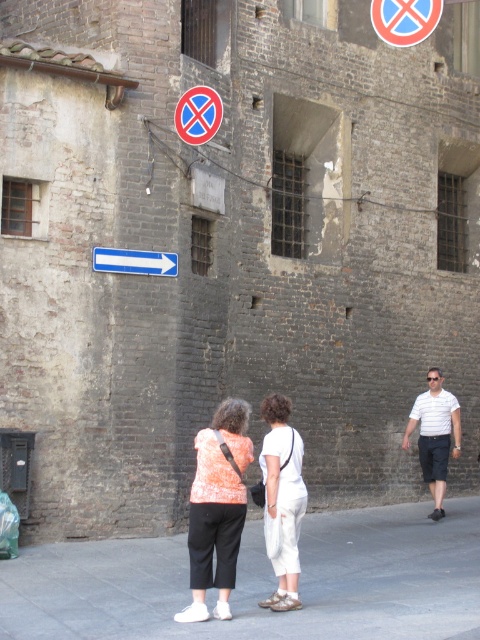
Is orange printed blouse at center thinner than white cotton shirt at right?

Indeed, orange printed blouse at center has a lesser width compared to white cotton shirt at right.

Is orange printed blouse at center closer to the viewer compared to white cotton shirt at right?

Yes, it is.

Which is behind, point (231, 529) or point (447, 451)?

The point (447, 451) is behind.

Find the location of a particular element. This screenshot has width=480, height=640. orange printed blouse at center is located at coordinates (216, 508).

Is point (224, 464) less distant than point (424, 3)?

That is True.

The image size is (480, 640). Find the location of `orange printed blouse at center`. orange printed blouse at center is located at coordinates point(216,508).

Which is behind, point (294, 628) or point (445, 394)?

The point (445, 394) is behind.

Is gray concrete pavement at center taller than white cotton shirt at right?

No, gray concrete pavement at center is not taller than white cotton shirt at right.

Find the location of a particular element. The height and width of the screenshot is (640, 480). gray concrete pavement at center is located at coordinates [261, 582].